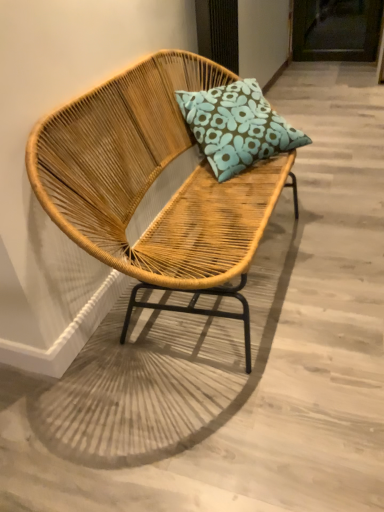
What do you see at coordinates (154, 185) in the screenshot?
I see `bamboo woven chair at center` at bounding box center [154, 185].

This screenshot has width=384, height=512. What are the coordinates of `bamboo woven chair at center` in the screenshot? It's located at (154, 185).

You are a GUI agent. You are given a task and a screenshot of the screen. Output one action in this format:
    pyautogui.click(x=<x>, y=<y>)
    Task: Click on the blue floral cushion at center
    
    Given the screenshot: What is the action you would take?
    pyautogui.click(x=236, y=126)

In order to face blue floral cushion at center, should I rotate leftwards or rightwards?

Turn right by 6.420 degrees to look at blue floral cushion at center.

The image size is (384, 512). What do you see at coordinates (236, 126) in the screenshot?
I see `blue floral cushion at center` at bounding box center [236, 126].

This screenshot has width=384, height=512. Find the location of `bamboo woven chair at center`. bamboo woven chair at center is located at coordinates (154, 185).

Considering the positions of objects bamboo woven chair at center and blue floral cushion at center in the image provided, who is more to the left, bamboo woven chair at center or blue floral cushion at center?

From the viewer's perspective, bamboo woven chair at center appears more on the left side.

In the image, is bamboo woven chair at center positioned in front of or behind blue floral cushion at center?

Clearly, bamboo woven chair at center is in front of blue floral cushion at center.

Which is in front, point (229, 185) or point (263, 110)?

The point (229, 185) is closer.

From the image's perspective, is bamboo woven chair at center over blue floral cushion at center?

No.

From a real-world perspective, which object rests below the other?

In real-world perspective, bamboo woven chair at center is lower.

Between bamboo woven chair at center and blue floral cushion at center, which one has larger width?

With larger width is bamboo woven chair at center.

Looking at this image, can you confirm if bamboo woven chair at center is taller than blue floral cushion at center?

Indeed, bamboo woven chair at center has a greater height compared to blue floral cushion at center.

Considering the sizes of bamboo woven chair at center and blue floral cushion at center in the image, is bamboo woven chair at center bigger or smaller than blue floral cushion at center?

bamboo woven chair at center is bigger than blue floral cushion at center.

Is bamboo woven chair at center inside the boundaries of blue floral cushion at center, or outside?

The correct answer is: outside.

Are bamboo woven chair at center and blue floral cushion at center beside each other?

No.

Could you tell me if bamboo woven chair at center is facing blue floral cushion at center?

Yes, bamboo woven chair at center faces towards blue floral cushion at center.

How far apart are bamboo woven chair at center and blue floral cushion at center?

The distance of bamboo woven chair at center from blue floral cushion at center is 11.87 inches.

Find the location of `chair that is in front of the blue floral cushion at center`. chair that is in front of the blue floral cushion at center is located at coordinates (154, 185).

In the image, is blue floral cushion at center on the left side or the right side of bamboo woven chair at center?

In the image, blue floral cushion at center appears on the right side of bamboo woven chair at center.

Considering the positions of objects blue floral cushion at center and bamboo woven chair at center in the image provided, who is in front, blue floral cushion at center or bamboo woven chair at center?

bamboo woven chair at center is more forward.

Between point (223, 180) and point (161, 283), which one is positioned in front?

The point (161, 283) is more forward.

Looking at this image, from the image's perspective, which is above, blue floral cushion at center or bamboo woven chair at center?

blue floral cushion at center is shown above in the image.

From a real-world perspective, which is physically above, blue floral cushion at center or bamboo woven chair at center?

From a 3D spatial view, blue floral cushion at center is above.

Considering the sizes of blue floral cushion at center and bamboo woven chair at center in the image, is blue floral cushion at center wider or thinner than bamboo woven chair at center?

In the image, blue floral cushion at center appears to be more narrow than bamboo woven chair at center.

Considering the sizes of objects blue floral cushion at center and bamboo woven chair at center in the image provided, who is shorter, blue floral cushion at center or bamboo woven chair at center?

With less height is blue floral cushion at center.

Considering the relative sizes of blue floral cushion at center and bamboo woven chair at center in the image provided, is blue floral cushion at center smaller than bamboo woven chair at center?

Yes.

Is bamboo woven chair at center a part of blue floral cushion at center?

Actually, bamboo woven chair at center is outside blue floral cushion at center.

Is blue floral cushion at center positioned far away from bamboo woven chair at center?

blue floral cushion at center is actually quite close to bamboo woven chair at center.

Is blue floral cushion at center looking in the opposite direction of bamboo woven chair at center?

Yes.

How many degrees apart are the facing directions of blue floral cushion at center and bamboo woven chair at center?

There is a 39.2-degree angle between the facing directions of blue floral cushion at center and bamboo woven chair at center.

Find the location of a particular element. This screenshot has width=384, height=512. chair that appears below the blue floral cushion at center (from the image's perspective) is located at coordinates (154, 185).

I want to click on pillow above the bamboo woven chair at center (from the image's perspective), so click(236, 126).

At what (x,y) coordinates should I click in order to perform the action: click on pillow on the right of bamboo woven chair at center. Please return your answer as a coordinate pair (x, y). Looking at the image, I should click on (236, 126).